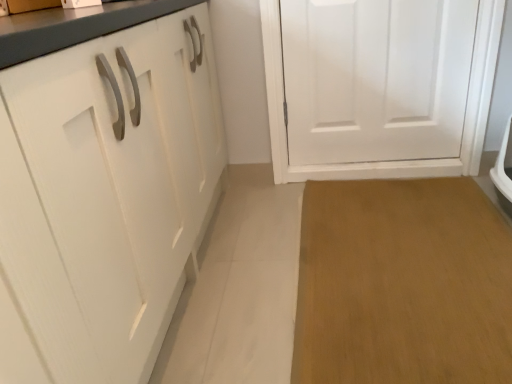
Question: From a real-world perspective, is white matte door at center physically located above or below brown wood floor at lower right?

Choices:
 (A) below
 (B) above

Answer: (B)

Question: Is white matte door at center inside the boundaries of brown wood floor at lower right, or outside?

Choices:
 (A) outside
 (B) inside

Answer: (A)

Question: Considering the positions of point (x=291, y=26) and point (x=497, y=264), is point (x=291, y=26) closer or farther from the camera than point (x=497, y=264)?

Choices:
 (A) farther
 (B) closer

Answer: (A)

Question: Relative to white matte door at center, is brown wood floor at lower right in front or behind?

Choices:
 (A) behind
 (B) front

Answer: (B)

Question: Is brown wood floor at lower right inside or outside of white matte door at center?

Choices:
 (A) outside
 (B) inside

Answer: (A)

Question: Is brown wood floor at lower right taller or shorter than white matte door at center?

Choices:
 (A) short
 (B) tall

Answer: (A)

Question: Based on their sizes in the image, would you say brown wood floor at lower right is bigger or smaller than white matte door at center?

Choices:
 (A) small
 (B) big

Answer: (A)